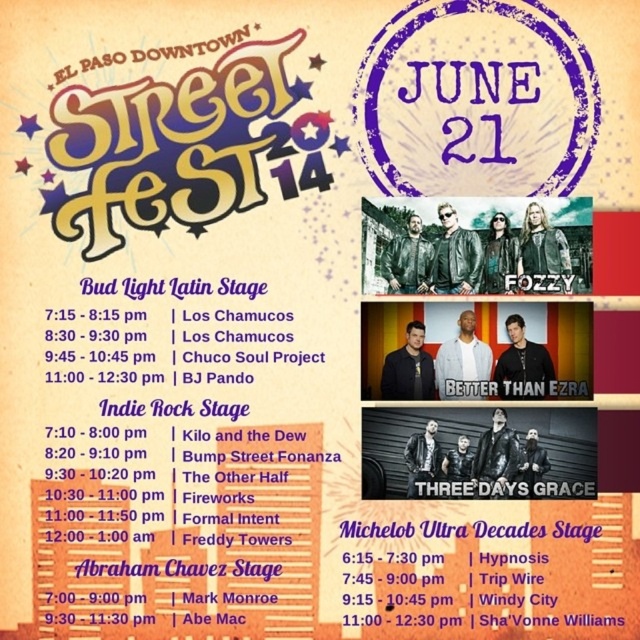
Question: Is leather jackets at center wider than blacktexturedbetter than ezra at center?

Choices:
 (A) yes
 (B) no

Answer: (A)

Question: Which of the following is the closest to the observer?

Choices:
 (A) michelob ultra decades stage at center
 (B) purple paper stage at center
 (C) blacktexturedbetter than ezra at center

Answer: (A)

Question: Which point is closer to the camera taking this photo?

Choices:
 (A) (48, 548)
 (B) (557, 384)
 (C) (460, 618)
 (D) (496, 198)

Answer: (A)

Question: Considering the relative positions of purple paper stage at center and michelob ultra decades stage at center in the image provided, where is purple paper stage at center located with respect to michelob ultra decades stage at center?

Choices:
 (A) above
 (B) below

Answer: (A)

Question: Which is farther from the michelob ultra decades stage at center?

Choices:
 (A) blacktexturedbetter than ezra at center
 (B) purple paper stage at center
 (C) leather jackets at center

Answer: (C)

Question: Is purple paper stage at center wider than blacktexturedbetter than ezra at center?

Choices:
 (A) yes
 (B) no

Answer: (A)